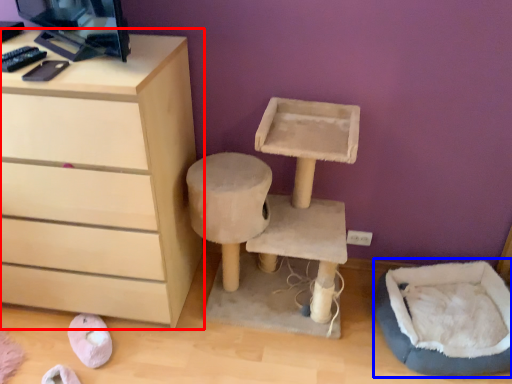
Question: Which point is further to the camera, chest of drawers (highlighted by a red box) or bean bag chair (highlighted by a blue box)?

Choices:
 (A) chest of drawers
 (B) bean bag chair

Answer: (B)